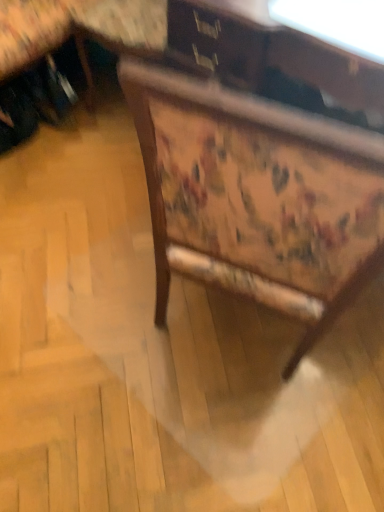
The image size is (384, 512). I want to click on free space to the left of wooden floral-patterned dresser at center, so click(x=83, y=288).